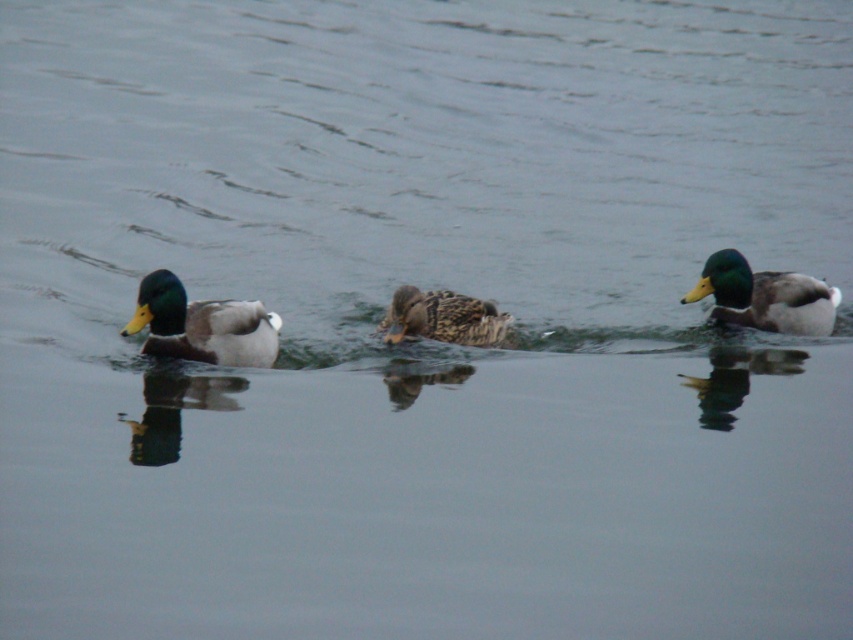
Question: Is matte green duck at left wider than brown speckled duck at center?

Choices:
 (A) yes
 (B) no

Answer: (B)

Question: Which object is positioned closest to the green glossy duck at right?

Choices:
 (A) matte green duck at left
 (B) brown speckled duck at center

Answer: (B)

Question: Is green glossy duck at right above brown speckled duck at center?

Choices:
 (A) no
 (B) yes

Answer: (B)

Question: Which is farther from the brown speckled duck at center?

Choices:
 (A) green glossy duck at right
 (B) matte green duck at left

Answer: (A)

Question: Does matte green duck at left appear on the right side of brown speckled duck at center?

Choices:
 (A) no
 (B) yes

Answer: (A)

Question: Among these objects, which one is farthest from the camera?

Choices:
 (A) brown speckled duck at center
 (B) green glossy duck at right

Answer: (B)